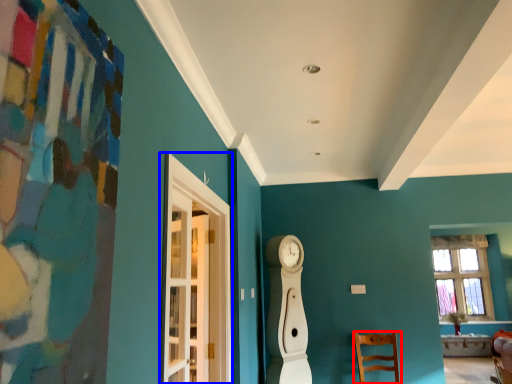
Question: Which object appears farthest to the camera in this image, chair (highlighted by a red box) or glass door (highlighted by a blue box)?

Choices:
 (A) chair
 (B) glass door

Answer: (A)